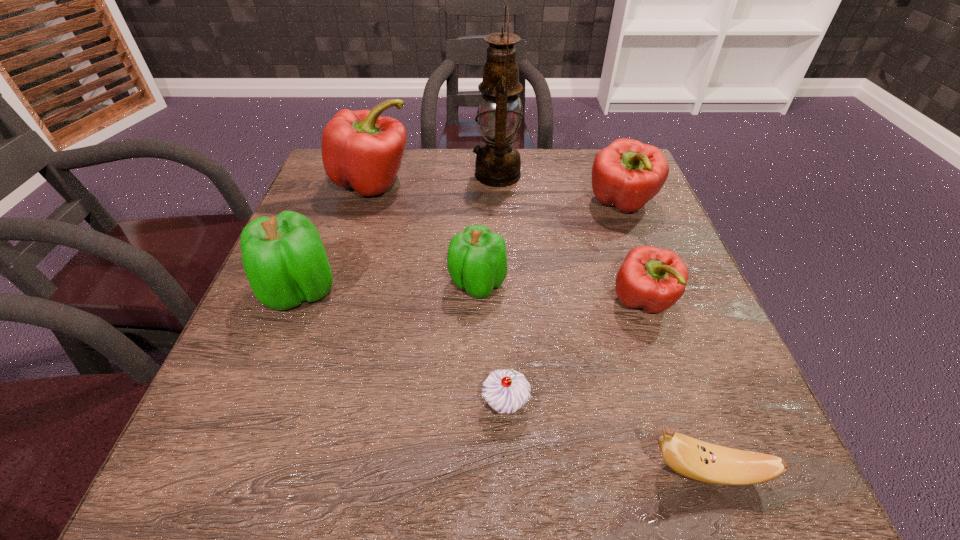
Where is `the tallest object`? The height and width of the screenshot is (540, 960). the tallest object is located at coordinates tap(498, 164).

The height and width of the screenshot is (540, 960). Identify the location of brown oil lamp. (498, 164).

Where is `the biggest pink bell pepper`? This screenshot has height=540, width=960. the biggest pink bell pepper is located at coordinates (360, 149).

Where is `the bigger green bell pepper`? This screenshot has height=540, width=960. the bigger green bell pepper is located at coordinates (284, 259).

Where is `the second biggest pink bell pepper`? This screenshot has height=540, width=960. the second biggest pink bell pepper is located at coordinates (627, 174).

Where is `the third bell pepper from right to left`? This screenshot has height=540, width=960. the third bell pepper from right to left is located at coordinates (476, 261).

The width and height of the screenshot is (960, 540). What are the coordinates of `the smaller green bell pepper` in the screenshot? It's located at pyautogui.click(x=476, y=261).

What are the coordinates of `the nearest pink bell pepper` in the screenshot? It's located at (654, 279).

Locate an element on the screen. gray cupcake is located at coordinates (506, 391).

Identify the location of the second nearest object. This screenshot has width=960, height=540. (506, 391).